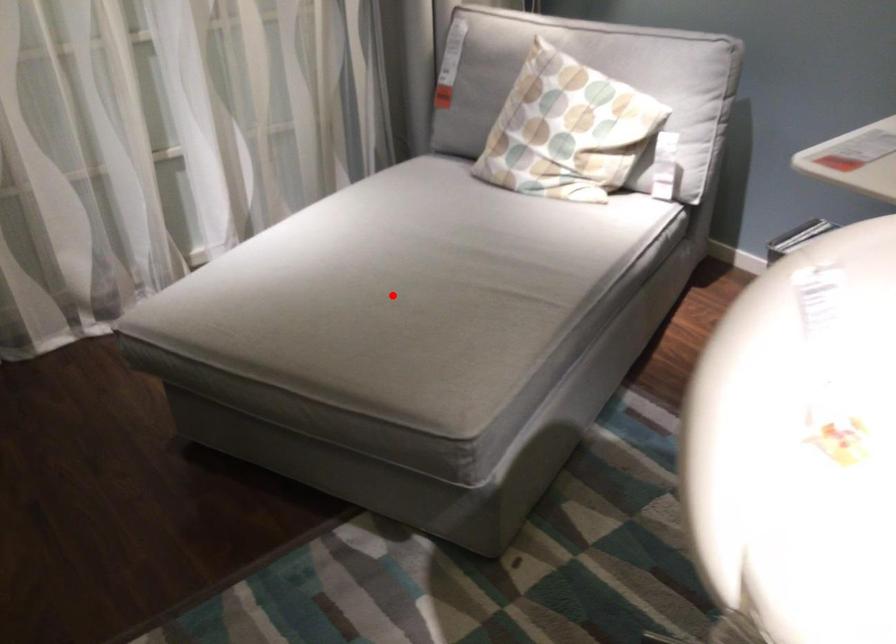
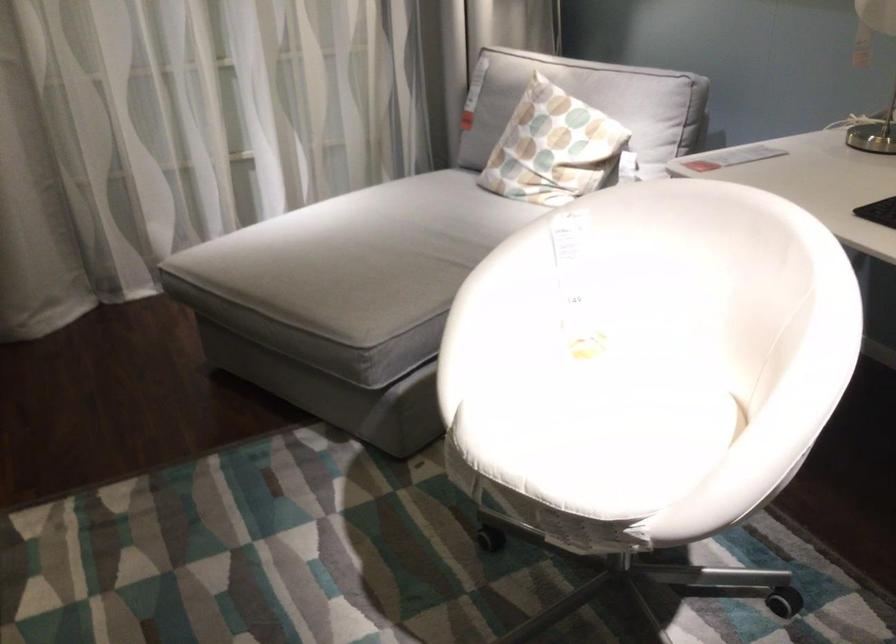
The point at the highlighted location is marked in the first image. Where is the corresponding point in the second image?

(359, 256)